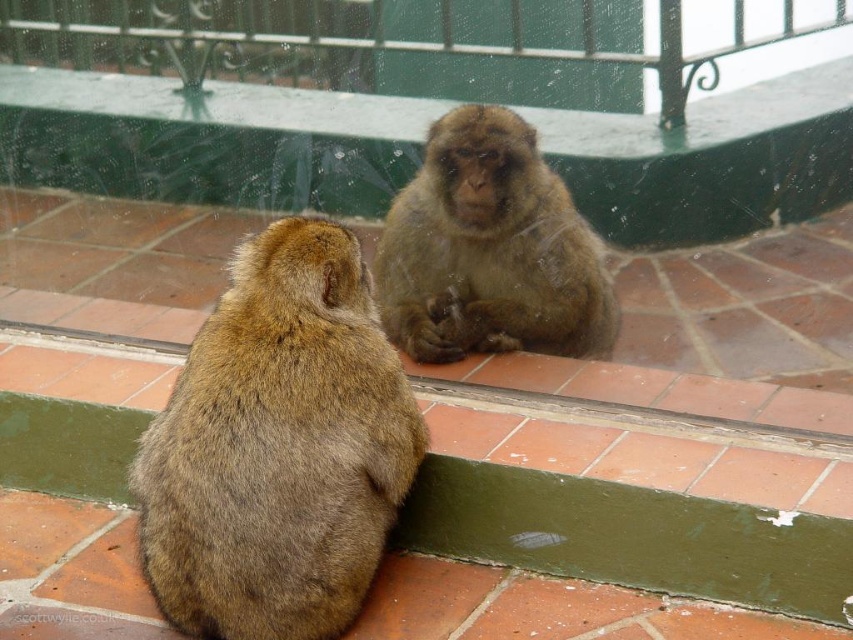
Consider the image. Is the position of brown furry monkey at lower left more distant than that of brown furry monkey at center?

No, brown furry monkey at lower left is in front of brown furry monkey at center.

This screenshot has width=853, height=640. What do you see at coordinates (277, 445) in the screenshot?
I see `brown furry monkey at lower left` at bounding box center [277, 445].

Describe the element at coordinates (277, 445) in the screenshot. I see `brown furry monkey at lower left` at that location.

The width and height of the screenshot is (853, 640). I want to click on brown furry monkey at lower left, so click(x=277, y=445).

Measure the distance between point (392, 240) and camera.

Point (392, 240) and camera are 8.48 feet apart.

Who is more distant from viewer, (395, 250) or (668, 64)?

Point (395, 250)

Does point (520, 211) come farther from viewer compared to point (758, 38)?

That is True.

Identify the location of brown furry monkey at center. [490, 250].

Is point (311, 276) in front of point (831, 20)?

No, (311, 276) is behind (831, 20).

Is brown furry monkey at lower left positioned at the back of green glass rail at upper center?

Yes, it is.

At what (x,y) coordinates should I click in order to perform the action: click on brown furry monkey at lower left. Please return your answer as a coordinate pair (x, y). The height and width of the screenshot is (640, 853). Looking at the image, I should click on (277, 445).

The height and width of the screenshot is (640, 853). I want to click on brown furry monkey at lower left, so click(x=277, y=445).